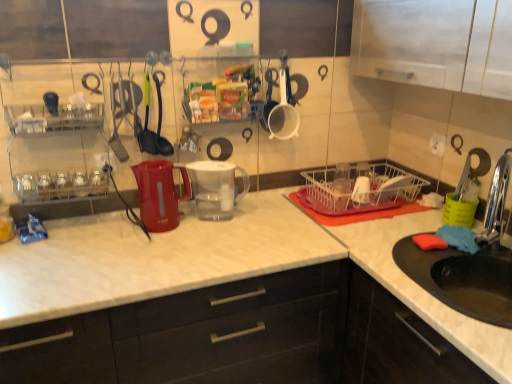
Find the location of a particular element. This screenshot has width=512, height=384. free region on the left part of matte plastic kettle at center, the second appliance when ordered from right to left is located at coordinates (116, 235).